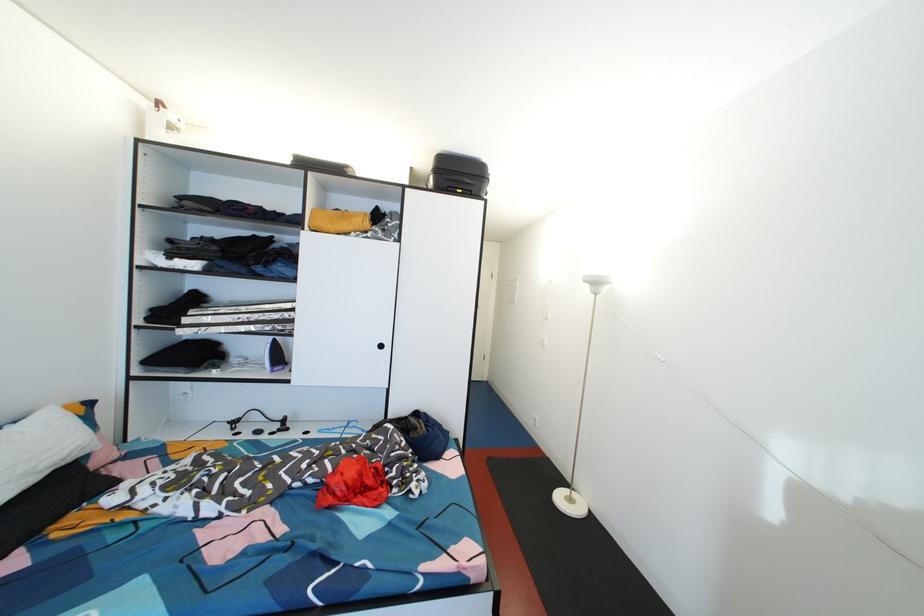
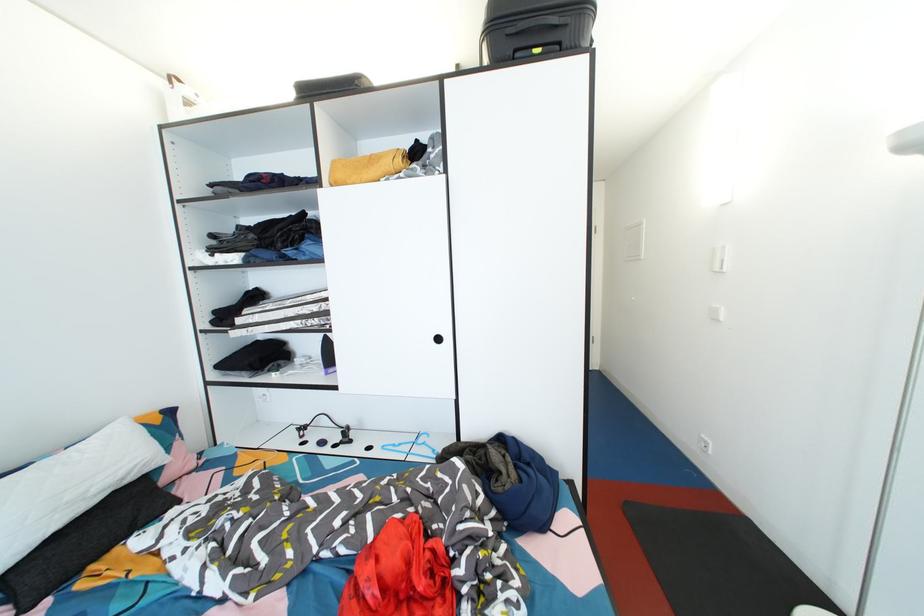
Locate, in the second image, the point that corresponds to point 341,434 in the first image.

(407, 450)